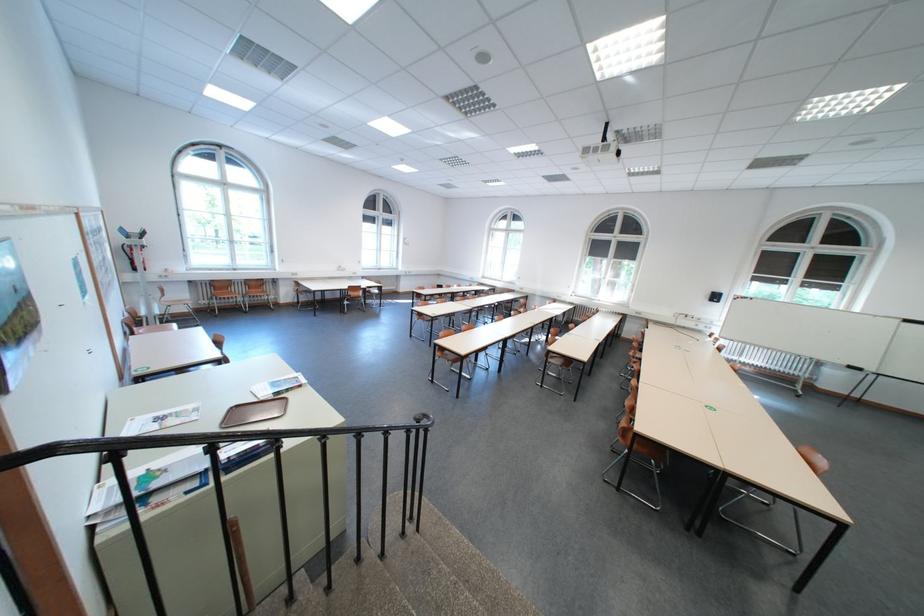
Locate an element on the screen. The height and width of the screenshot is (616, 924). fire extinguisher handle is located at coordinates (123, 252).